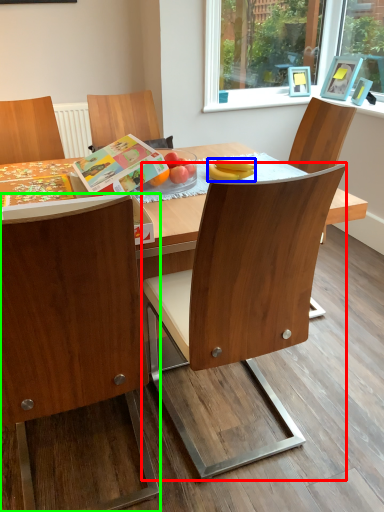
Question: Considering the real-world distances, which object is farthest from chair (highlighted by a red box)? banana (highlighted by a blue box) or chair (highlighted by a green box)?

Choices:
 (A) banana
 (B) chair

Answer: (A)